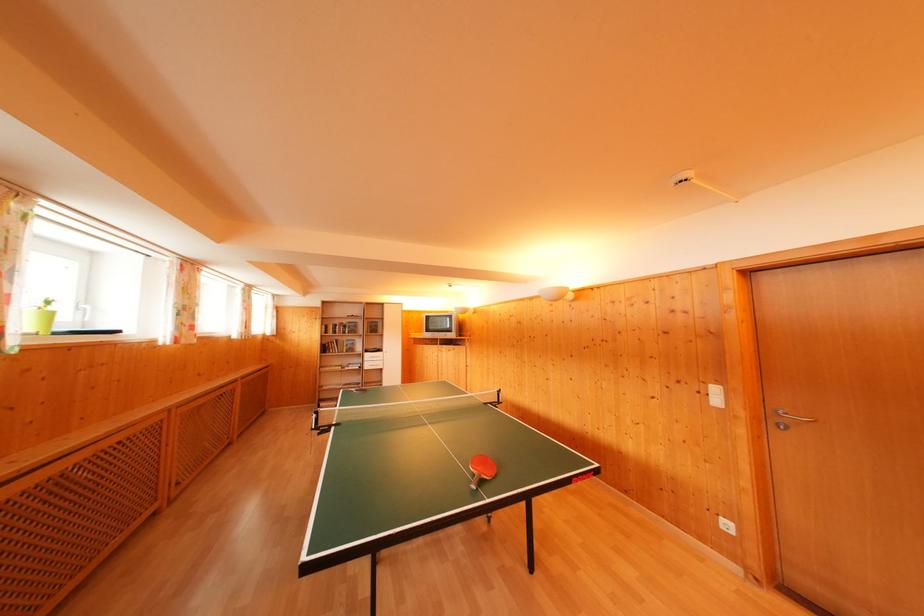
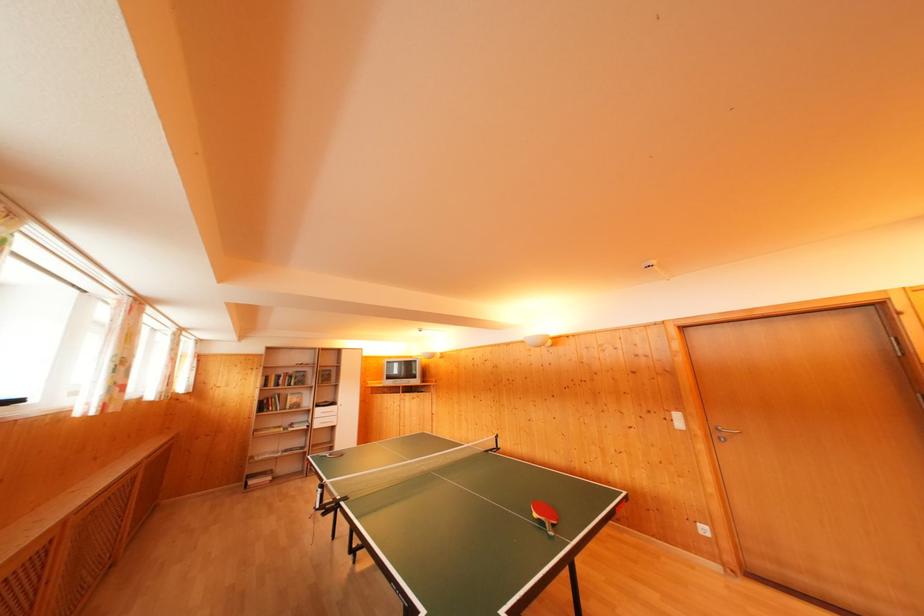
Where in the second image is the point corresponding to point 770,424 from the first image?

(718, 440)